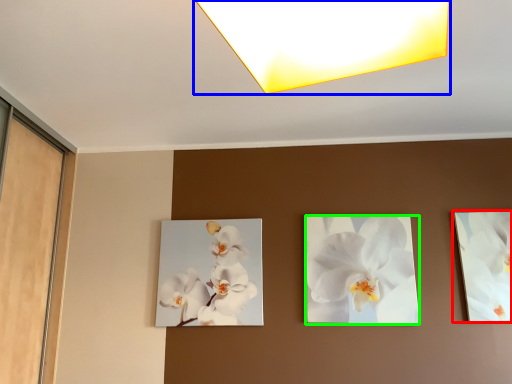
Question: Based on their relative distances, which object is nearer to picture frame (highlighted by a red box)? Choose from lamp (highlighted by a blue box) and flower (highlighted by a green box).

Choices:
 (A) lamp
 (B) flower

Answer: (B)